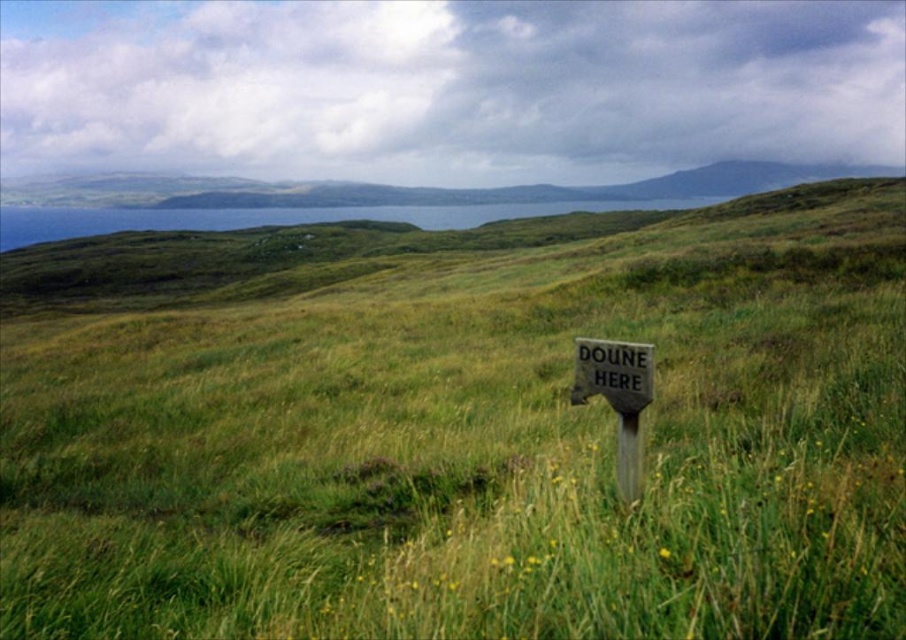
Is green grassy at center wider than wooden signpost at center?

Correct, the width of green grassy at center exceeds that of wooden signpost at center.

Identify the location of green grassy at center. Image resolution: width=906 pixels, height=640 pixels. (459, 428).

At what (x,y) coordinates should I click in order to perform the action: click on green grassy at center. Please return your answer as a coordinate pair (x, y). Looking at the image, I should click on (459, 428).